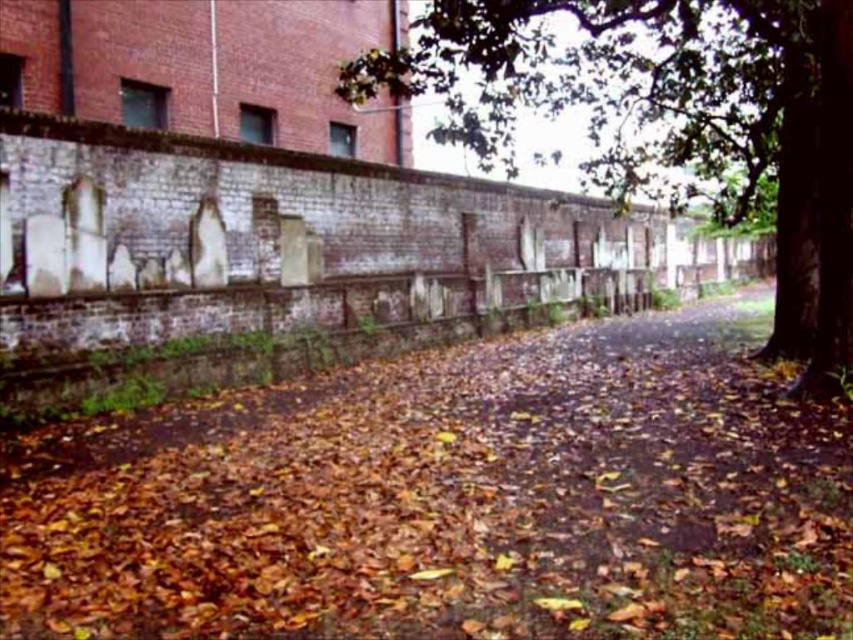
You are standing on the pathway in front of the brick wall and want to pick up the brown leafy dirt at center and the green leafy tree at center. Which object do you need to walk towards to get closer to both?

You need to walk towards the green leafy tree at center because the brown leafy dirt at center is closer to you than the green leafy tree at center, so moving towards the tree will bring you closer to both objects.

You are a gardener planning to plant a new shrub in the urban area shown. The shrub requires a planting space that is wider than the brown leafy dirt at center. Can you determine if the green leafy tree at center provides enough space for the shrub?

The brown leafy dirt at center has a lesser width compared to the green leafy tree at center. Since the shrub requires a space wider than the brown leafy dirt, the green leafy tree at center, being wider, can provide sufficient space for the shrub.

You are a gardener standing on the pathway in front of the brick wall. You notice the brown leafy dirt at center and the green leafy tree at center. Which object is directly above the other?

The green leafy tree at center is directly above the brown leafy dirt at center because the brown leafy dirt at center is positioned under the green leafy tree at center.